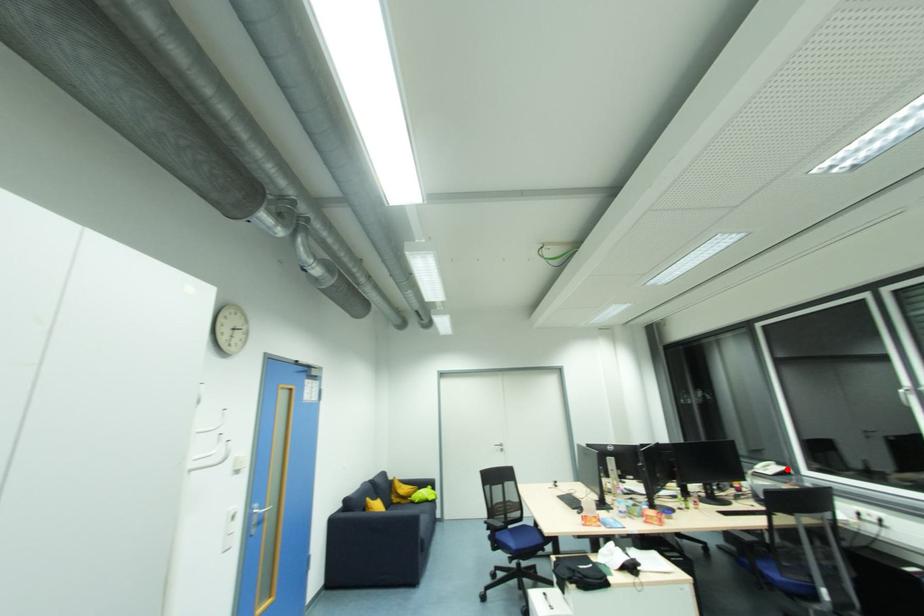
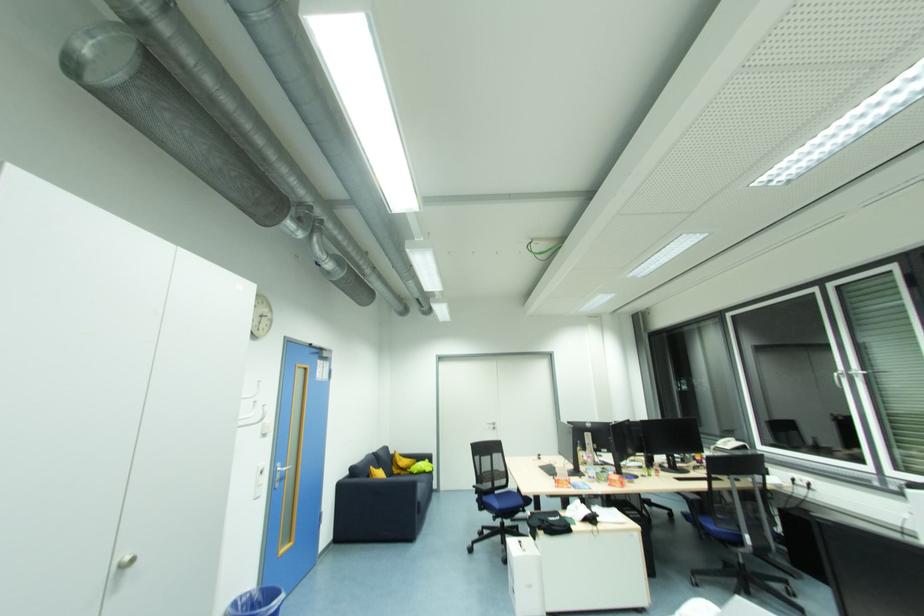
Find the pixel in the second image that matches the highlighted location in the first image.

(745, 446)